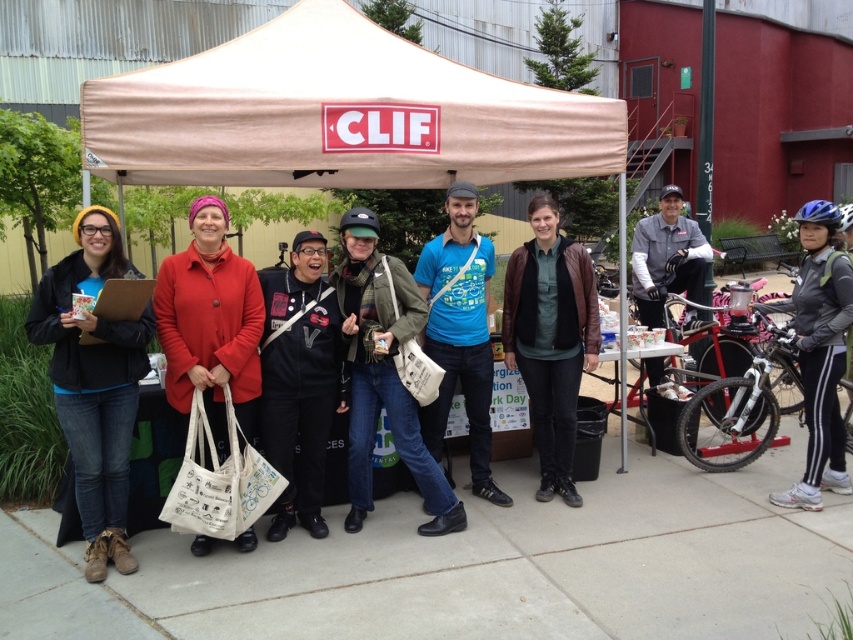
You are standing at the entrance of the CLIF canopy tent and see the point marked as point (210,323). What object is located at that point?

The point (210,323) corresponds to the location of the matte red coat at center.

You are organizing an outdoor event and need to place a 18 inch wide promotional banner between the green canvas bag at center and the gray matte jacket at right. Can the space between them accommodate the banner?

The green canvas bag at center is wider than the gray matte jacket at right. However, the exact distance between them isn

Based on the photo, you are a participant at the event and want to identify the person in the matte red coat at center. Where is this person positioned relative to the blue matte shirt at center?

The matte red coat at center is located above the blue matte shirt at center, meaning the person wearing the matte red coat at center is standing in a higher position or closer to the front compared to the blue matte shirt at center.